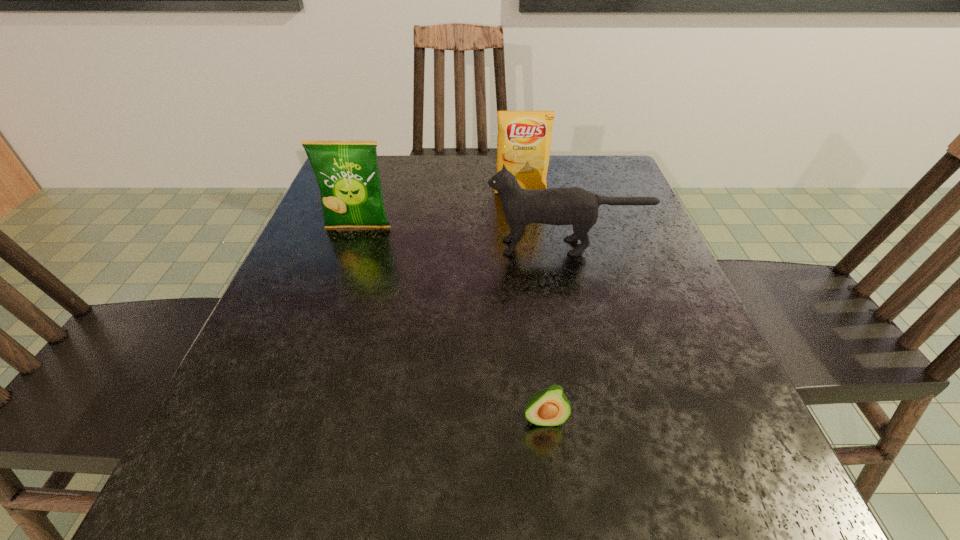
Point out which object is positioned as the nearest to the cat. Please provide its 2D coordinates. Your answer should be formatted as a tuple, i.e. [(x, y)], where the tuple contains the x and y coordinates of a point satisfying the conditions above.

[(524, 139)]

Where is `free space that satisfies the following two spatial constraints: 1. on the front-facing side of the second nearest object; 2. on the cut side of the shortest object`? The height and width of the screenshot is (540, 960). free space that satisfies the following two spatial constraints: 1. on the front-facing side of the second nearest object; 2. on the cut side of the shortest object is located at coordinates (607, 419).